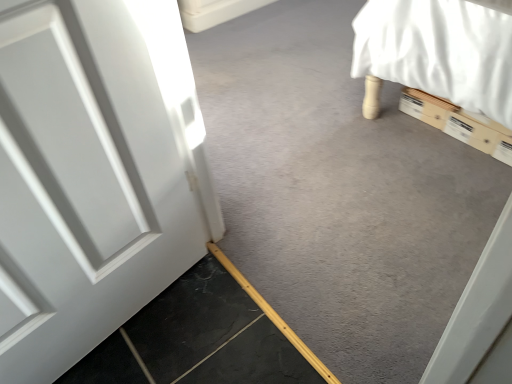
Question: Considering the relative sizes of smooth gray concrete at lower left, the first concrete in the top-to-bottom sequence, and smooth gray concrete at bottom left, acting as the first concrete starting from the bottom, in the image provided, is smooth gray concrete at lower left, the first concrete in the top-to-bottom sequence, smaller than smooth gray concrete at bottom left, acting as the first concrete starting from the bottom,?

Choices:
 (A) no
 (B) yes

Answer: (A)

Question: Is the position of smooth gray concrete at lower left, the first concrete in the top-to-bottom sequence, more distant than that of smooth gray concrete at bottom left, acting as the first concrete starting from the bottom?

Choices:
 (A) no
 (B) yes

Answer: (B)

Question: Is smooth gray concrete at lower left, the second concrete in the bottom-to-top sequence, next to smooth gray concrete at bottom left, which is counted as the second concrete, starting from the top?

Choices:
 (A) no
 (B) yes

Answer: (A)

Question: From the image's perspective, is smooth gray concrete at lower left, the second concrete in the bottom-to-top sequence, under smooth gray concrete at bottom left, acting as the first concrete starting from the bottom?

Choices:
 (A) no
 (B) yes

Answer: (A)

Question: From the image's perspective, would you say smooth gray concrete at lower left, the first concrete in the top-to-bottom sequence, is positioned over smooth gray concrete at bottom left, acting as the first concrete starting from the bottom?

Choices:
 (A) no
 (B) yes

Answer: (B)

Question: Is smooth gray concrete at lower left, the first concrete in the top-to-bottom sequence, positioned in front of smooth gray concrete at bottom left, acting as the first concrete starting from the bottom?

Choices:
 (A) yes
 (B) no

Answer: (B)

Question: From a real-world perspective, is smooth gray concrete at bottom left, acting as the first concrete starting from the bottom, physically above smooth gray concrete at lower left, the first concrete in the top-to-bottom sequence?

Choices:
 (A) yes
 (B) no

Answer: (A)

Question: Considering the relative positions of smooth gray concrete at bottom left, which is counted as the second concrete, starting from the top, and smooth gray concrete at lower left, the second concrete in the bottom-to-top sequence, in the image provided, is smooth gray concrete at bottom left, which is counted as the second concrete, starting from the top, behind smooth gray concrete at lower left, the second concrete in the bottom-to-top sequence,?

Choices:
 (A) no
 (B) yes

Answer: (A)

Question: Is smooth gray concrete at bottom left, acting as the first concrete starting from the bottom, oriented towards smooth gray concrete at lower left, the second concrete in the bottom-to-top sequence?

Choices:
 (A) no
 (B) yes

Answer: (B)

Question: From a real-world perspective, is smooth gray concrete at bottom left, which is counted as the second concrete, starting from the top, under smooth gray concrete at lower left, the second concrete in the bottom-to-top sequence?

Choices:
 (A) yes
 (B) no

Answer: (B)

Question: Is smooth gray concrete at lower left, the first concrete in the top-to-bottom sequence, inside smooth gray concrete at bottom left, acting as the first concrete starting from the bottom?

Choices:
 (A) yes
 (B) no

Answer: (B)

Question: Is smooth gray concrete at bottom left, which is counted as the second concrete, starting from the top, thinner than smooth gray concrete at lower left, the second concrete in the bottom-to-top sequence?

Choices:
 (A) no
 (B) yes

Answer: (B)

Question: In terms of width, does smooth gray concrete at bottom left, which is counted as the second concrete, starting from the top, look wider or thinner when compared to smooth gray concrete at lower left, the second concrete in the bottom-to-top sequence?

Choices:
 (A) wide
 (B) thin

Answer: (B)